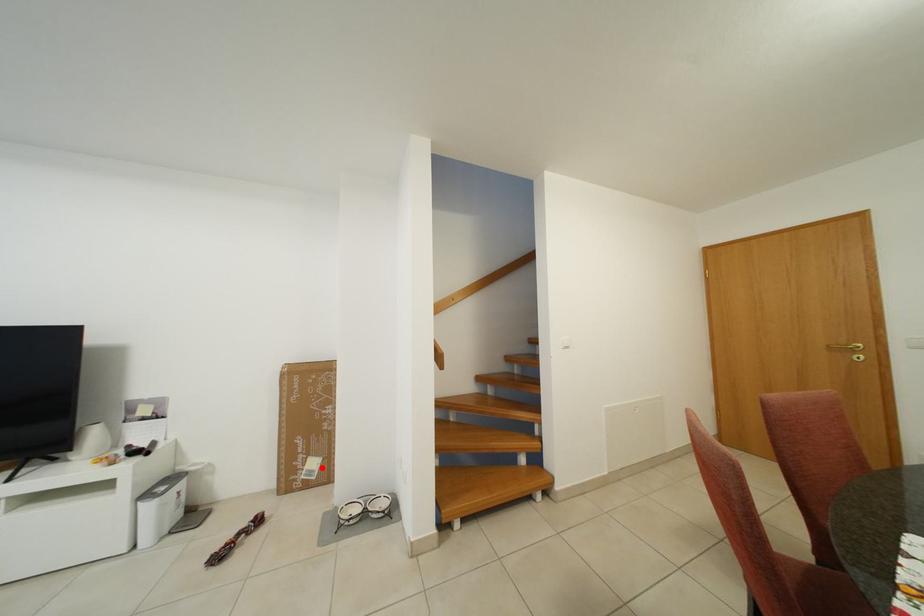
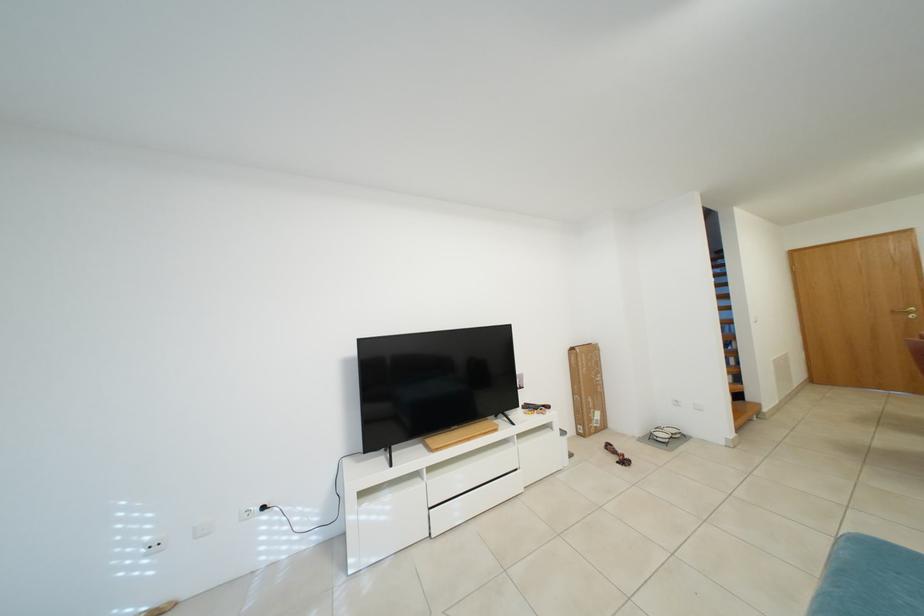
Question: I am providing you with two images of the same scene from different viewpoints. Given a red point in image1, look at the same physical point in image2. Is it:

Choices:
 (A) Closer to the viewpoint
 (B) Farther from the viewpoint

Answer: (B)